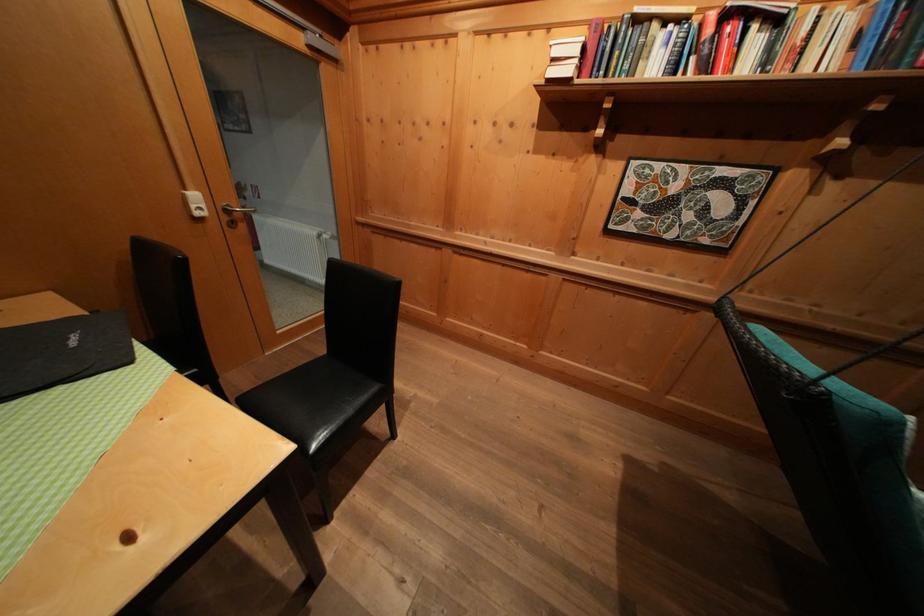
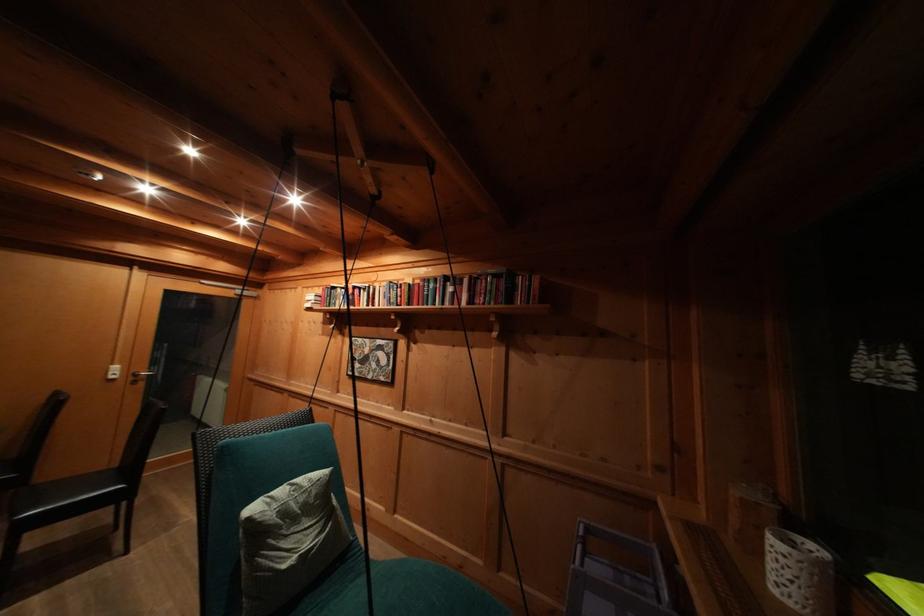
Find the pixel in the second image that matches the point at 235,217 in the first image.

(141, 379)